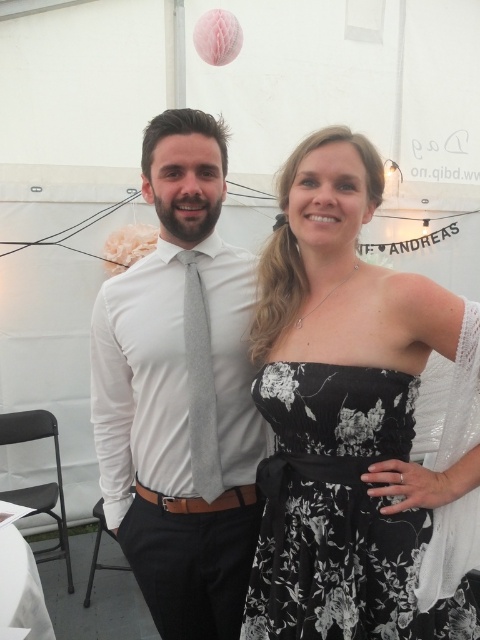
Can you confirm if black floral dress at center is positioned above gray textured tie at center?

No.

Does black floral dress at center come in front of gray textured tie at center?

Yes, it is in front of gray textured tie at center.

Is point (309, 428) farther from viewer compared to point (208, 380)?

No, (309, 428) is closer to viewer.

This screenshot has width=480, height=640. In order to click on black floral dress at center in this screenshot , I will do `click(340, 513)`.

Which is below, white satin dress at center or matte gray tie at center?

Positioned lower is matte gray tie at center.

Is point (454, 582) positioned in front of point (156, 577)?

Yes, it is in front of point (156, 577).

Where is `white satin dress at center`? The height and width of the screenshot is (640, 480). white satin dress at center is located at coordinates [x=357, y=422].

Between white satin dress at center and black floral dress at center, which one has less height?

black floral dress at center is shorter.

Does white satin dress at center have a smaller size compared to black floral dress at center?

No, white satin dress at center is not smaller than black floral dress at center.

Who is more forward, (399, 384) or (372, 589)?

Point (372, 589) is in front.

The width and height of the screenshot is (480, 640). I want to click on white satin dress at center, so click(357, 422).